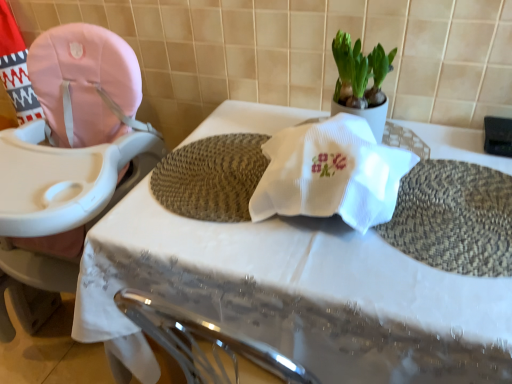
Image resolution: width=512 pixels, height=384 pixels. What do you see at coordinates (361, 81) in the screenshot? I see `green leafy plant at upper center` at bounding box center [361, 81].

This screenshot has width=512, height=384. Describe the element at coordinates (300, 293) in the screenshot. I see `white woven placemat at center` at that location.

Identify the location of pink fabric baby carriage at left. Image resolution: width=512 pixels, height=384 pixels. (71, 150).

Is white woven placemat at center inside or outside of pink fabric baby carriage at left?

The correct answer is: outside.

Is white woven placemat at center not near pink fabric baby carriage at left?

Actually, white woven placemat at center and pink fabric baby carriage at left are a little close together.

Is pink fabric baby carriage at left at the back of white woven placemat at center?

No, white woven placemat at center is not facing the opposite direction of pink fabric baby carriage at left.

Can you confirm if white woven placemat at center is wider than pink fabric baby carriage at left?

In fact, white woven placemat at center might be narrower than pink fabric baby carriage at left.

Looking at this image, would you say green leafy plant at upper center is outside pink fabric baby carriage at left?

Yes, green leafy plant at upper center is outside of pink fabric baby carriage at left.

Find the location of a particular element. Image resolution: width=512 pixels, height=384 pixels. houseplant located behind the pink fabric baby carriage at left is located at coordinates (361, 81).

Is green leafy plant at upper center wider or thinner than pink fabric baby carriage at left?

In the image, green leafy plant at upper center appears to be more narrow than pink fabric baby carriage at left.

Is green leafy plant at upper center aimed at pink fabric baby carriage at left?

No.

Does white woven placemat at center have a greater width compared to green leafy plant at upper center?

Correct, the width of white woven placemat at center exceeds that of green leafy plant at upper center.

Does point (300, 276) come closer to viewer compared to point (376, 129)?

Yes.

From the image's perspective, would you say white woven placemat at center is shown under green leafy plant at upper center?

Yes, from the image's perspective, white woven placemat at center is below green leafy plant at upper center.

Considering the sizes of objects white woven placemat at center and green leafy plant at upper center in the image provided, who is taller, white woven placemat at center or green leafy plant at upper center?

white woven placemat at center is taller.

The height and width of the screenshot is (384, 512). In order to click on houseplant on the right side of pink fabric baby carriage at left in this screenshot , I will do pyautogui.click(x=361, y=81).

What's the angular difference between pink fabric baby carriage at left and green leafy plant at upper center's facing directions?

They differ by 0.135 degrees in their facing directions.

Does point (86, 163) appear closer or farther from the camera than point (345, 41)?

Point (86, 163) is farther from the camera than point (345, 41).

From a real-world perspective, is pink fabric baby carriage at left positioned above or below green leafy plant at upper center?

Clearly, from a real-world perspective, pink fabric baby carriage at left is below green leafy plant at upper center.

Is pink fabric baby carriage at left inside the boundaries of white woven placemat at center, or outside?

pink fabric baby carriage at left is not inside white woven placemat at center, it's outside.

From the image's perspective, relative to white woven placemat at center, is pink fabric baby carriage at left above or below?

Based on their image positions, pink fabric baby carriage at left is located above white woven placemat at center.

From the picture: Based on their positions, is pink fabric baby carriage at left located to the left or right of white woven placemat at center?

Based on their positions, pink fabric baby carriage at left is located to the left of white woven placemat at center.

Which of these two, pink fabric baby carriage at left or white woven placemat at center, is bigger?

white woven placemat at center is bigger.

Based on their positions, is green leafy plant at upper center located to the left or right of white woven placemat at center?

Based on their positions, green leafy plant at upper center is located to the right of white woven placemat at center.

Between point (341, 69) and point (385, 340), which one is positioned behind?

Positioned behind is point (341, 69).

Is green leafy plant at upper center smaller than white woven placemat at center?

Indeed, green leafy plant at upper center has a smaller size compared to white woven placemat at center.

The width and height of the screenshot is (512, 384). I want to click on table in front of the pink fabric baby carriage at left, so click(x=300, y=293).

Identify the location of baby carriage below the green leafy plant at upper center (from a real-world perspective). (71, 150).

Based on the photo, which object lies nearer to the anchor point pink fabric baby carriage at left, green leafy plant at upper center or white woven placemat at center?

white woven placemat at center lies closer to pink fabric baby carriage at left than the other object.

Looking at this image, looking at the image, which one is located closer to green leafy plant at upper center, pink fabric baby carriage at left or white woven placemat at center?

white woven placemat at center lies closer to green leafy plant at upper center than the other object.

When comparing their distances from green leafy plant at upper center, does white woven placemat at center or pink fabric baby carriage at left seem closer?

Among the two, white woven placemat at center is located nearer to green leafy plant at upper center.

Considering their positions, is pink fabric baby carriage at left positioned further to white woven placemat at center than green leafy plant at upper center?

Among the two, green leafy plant at upper center is located further to white woven placemat at center.

In the scene shown: Which object lies nearer to the anchor point pink fabric baby carriage at left, white woven placemat at center or green leafy plant at upper center?

The object closer to pink fabric baby carriage at left is white woven placemat at center.

When comparing their distances from white woven placemat at center, does green leafy plant at upper center or pink fabric baby carriage at left seem closer?

pink fabric baby carriage at left is positioned closer to the anchor white woven placemat at center.

I want to click on table between pink fabric baby carriage at left and green leafy plant at upper center, so click(300, 293).